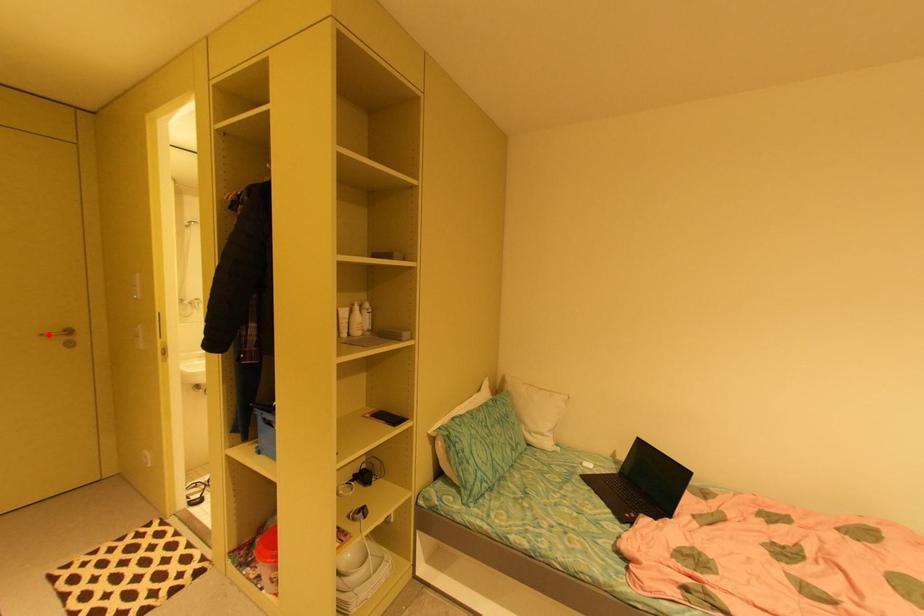
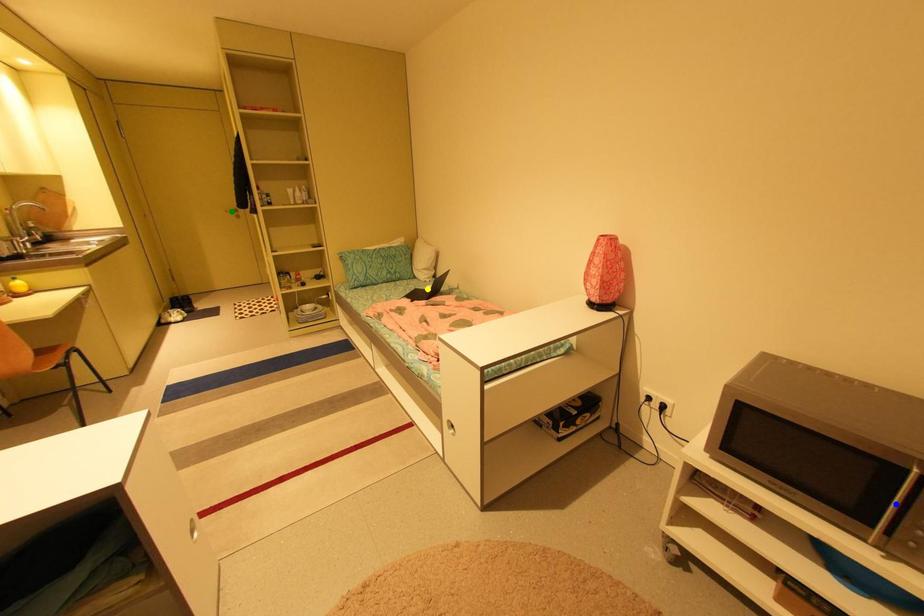
Question: I am providing you with two images of the same scene from different viewpoints. A red point is marked on the first image. You are given multiple points on the second image. Which mark in image 2 goes with the point in image 1?

Choices:
 (A) blue point
 (B) yellow point
 (C) green point

Answer: (C)